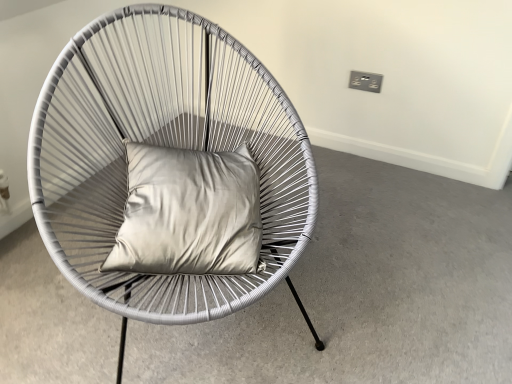
Describe the element at coordinates (188, 213) in the screenshot. The image size is (512, 384). I see `satin silver pillow at center` at that location.

Find the location of a particular element. The image size is (512, 384). satin silver pillow at center is located at coordinates (188, 213).

Is white woven chair at center at the back of satin silver pillow at center?

That's right, satin silver pillow at center is facing away from white woven chair at center.

Which object is wider, satin silver pillow at center or white woven chair at center?

Wider between the two is white woven chair at center.

How many degrees apart are the facing directions of satin silver pillow at center and white woven chair at center?

satin silver pillow at center and white woven chair at center are facing 22.3 degrees away from each other.

From the image's perspective, which is below, satin silver pillow at center or white woven chair at center?

From the image's view, satin silver pillow at center is below.

Does point (277, 378) come farther from viewer compared to point (64, 225)?

That is True.

Can you tell me how much matte white chair at center and white woven chair at center differ in facing direction?

141 degrees.

Considering the sizes of objects matte white chair at center and white woven chair at center in the image provided, who is wider, matte white chair at center or white woven chair at center?

Wider between the two is matte white chair at center.

Between matte white chair at center and white woven chair at center, which one appears on the left side from the viewer's perspective?

white woven chair at center.

Is white woven chair at center further to the viewer compared to satin silver pillow at center?

No, it is not.

Is white woven chair at center bigger or smaller than satin silver pillow at center?

Considering their sizes, white woven chair at center takes up more space than satin silver pillow at center.

From the image's perspective, is white woven chair at center under satin silver pillow at center?

No.

You are a GUI agent. You are given a task and a screenshot of the screen. Output one action in this format:
    pyautogui.click(x=<x>, y=<y>)
    Task: Click on the concrete in front of the satin silver pillow at center
    The width and height of the screenshot is (512, 384).
    Given the screenshot: What is the action you would take?
    pyautogui.click(x=366, y=292)

Is satin silver pillow at center at the back of matte white chair at center?

No, matte white chair at center is not facing the opposite direction of satin silver pillow at center.

Which of these two, matte white chair at center or satin silver pillow at center, is thinner?

satin silver pillow at center.

Who is shorter, matte white chair at center or satin silver pillow at center?

Standing shorter between the two is matte white chair at center.

Considering the positions of objects white woven chair at center and matte white chair at center in the image provided, who is behind, white woven chair at center or matte white chair at center?

matte white chair at center.

Looking at their sizes, would you say white woven chair at center is wider or thinner than matte white chair at center?

In the image, white woven chair at center appears to be more narrow than matte white chair at center.

Considering the points (80, 60) and (423, 264), which point is behind, point (80, 60) or point (423, 264)?

Point (423, 264)

In the scene shown: Considering the positions of objects satin silver pillow at center and matte white chair at center in the image provided, who is more to the right, satin silver pillow at center or matte white chair at center?

matte white chair at center is more to the right.

From a real-world perspective, between satin silver pillow at center and matte white chair at center, who is vertically higher?

In real-world perspective, satin silver pillow at center is above.

From the image's perspective, is satin silver pillow at center beneath matte white chair at center?

No, from the image's perspective, satin silver pillow at center is not beneath matte white chair at center.

Based on the photo, can you confirm if satin silver pillow at center is thinner than matte white chair at center?

Indeed, satin silver pillow at center has a lesser width compared to matte white chair at center.

Find the location of a particular element. The image size is (512, 384). pillow that appears on the right of white woven chair at center is located at coordinates (188, 213).

You are a GUI agent. You are given a task and a screenshot of the screen. Output one action in this format:
    pyautogui.click(x=<x>, y=<y>)
    Task: Click on the concrete below the white woven chair at center (from a real-world perspective)
    The height and width of the screenshot is (384, 512).
    Given the screenshot: What is the action you would take?
    pyautogui.click(x=366, y=292)

Which object lies further to the anchor point white woven chair at center, matte white chair at center or satin silver pillow at center?

Among the two, matte white chair at center is located further to white woven chair at center.

From the image, which object appears to be farther from satin silver pillow at center, white woven chair at center or matte white chair at center?

matte white chair at center lies further to satin silver pillow at center than the other object.

From the image, which object appears to be nearer to matte white chair at center, white woven chair at center or satin silver pillow at center?

Among the two, satin silver pillow at center is located nearer to matte white chair at center.

When comparing their distances from matte white chair at center, does satin silver pillow at center or white woven chair at center seem further?

white woven chair at center is positioned further to the anchor matte white chair at center.

When comparing their distances from satin silver pillow at center, does matte white chair at center or white woven chair at center seem further?

Based on the image, matte white chair at center appears to be further to satin silver pillow at center.

Considering their positions, is satin silver pillow at center positioned closer to white woven chair at center than matte white chair at center?

satin silver pillow at center lies closer to white woven chair at center than the other object.

You are a GUI agent. You are given a task and a screenshot of the screen. Output one action in this format:
    pyautogui.click(x=<x>, y=<y>)
    Task: Click on the concrete between white woven chair at center and satin silver pillow at center in the front-back direction
    
    Given the screenshot: What is the action you would take?
    pyautogui.click(x=366, y=292)